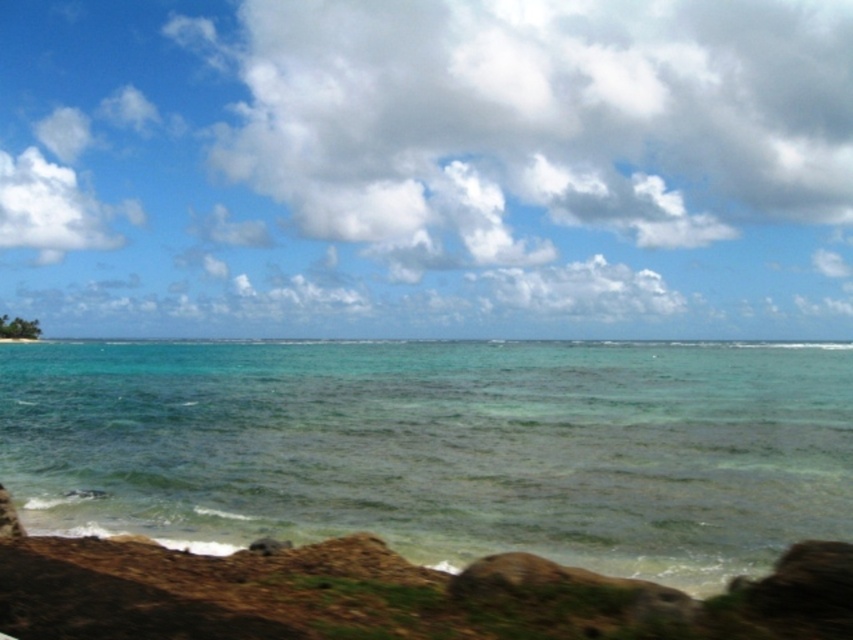
From the picture: You are standing on the rocky shoreline and looking at the sky. There is a point marked at coordinates point (x=543, y=120). What object is this point located on?

The point (x=543, y=120) is located on the white fluffy cloud at upper center.

You are standing on the rocky shoreline and looking at the clear water at center and the white fluffy cloud at upper left. Which object is nearer to you?

The clear water at center is closer to the viewer than the white fluffy cloud at upper left.